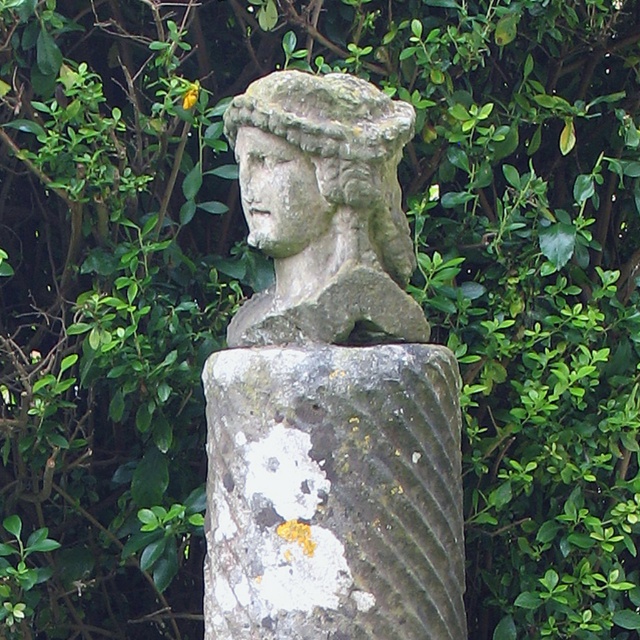
Question: Does stone statue at center have a greater width compared to stone statue head at center?

Choices:
 (A) no
 (B) yes

Answer: (B)

Question: Is stone statue at center bigger than stone statue head at center?

Choices:
 (A) no
 (B) yes

Answer: (B)

Question: Which point is closer to the camera?

Choices:
 (A) speckled stone column at center
 (B) stone statue at center

Answer: (B)

Question: Estimate the real-world distances between objects in this image. Which object is closer to the speckled stone column at center?

Choices:
 (A) stone statue head at center
 (B) stone statue at center

Answer: (B)

Question: Which point is farther from the camera taking this photo?

Choices:
 (A) (445, 369)
 (B) (248, 467)
 (C) (404, 109)

Answer: (C)

Question: Can you confirm if speckled stone column at center is positioned below stone statue head at center?

Choices:
 (A) yes
 (B) no

Answer: (A)